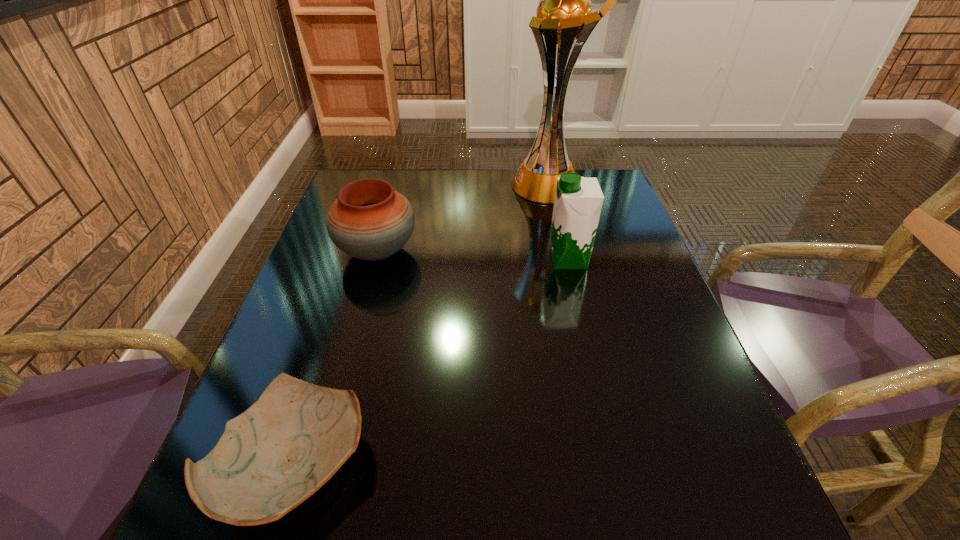
Image resolution: width=960 pixels, height=540 pixels. I want to click on the farthest object, so click(x=564, y=22).

Find the location of a particular element. Image resolution: width=960 pixels, height=540 pixels. trophy is located at coordinates (564, 22).

Find the location of a particular element. The image size is (960, 540). the second tallest object is located at coordinates (578, 201).

Identify the location of the taller pottery. (369, 220).

Identify the location of the farther pottery. The height and width of the screenshot is (540, 960). (369, 220).

At what (x,y) coordinates should I click in order to perform the action: click on free space located on the front-facing side of the tallest object. Please return your answer as a coordinate pair (x, y). The image size is (960, 540). Looking at the image, I should click on (420, 186).

The image size is (960, 540). I want to click on blank space located on the front-facing side of the tallest object, so click(x=387, y=186).

The width and height of the screenshot is (960, 540). In order to click on vacant space located 0.150m on the front-facing side of the tallest object in this screenshot , I will do `click(464, 186)`.

I want to click on vacant area situated on the front-facing side of the soya milk, so click(484, 259).

Find the location of a particular element. free location located on the front-facing side of the soya milk is located at coordinates (437, 259).